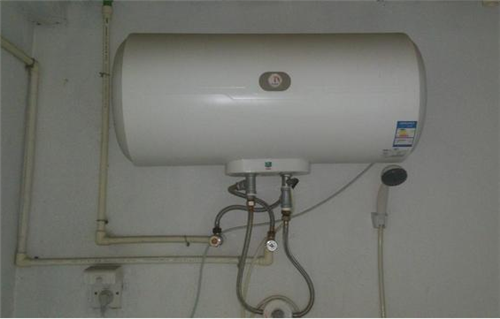
Identify the location of shower. (398, 178).